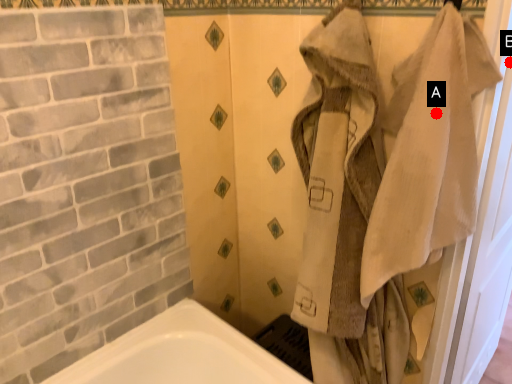
Question: Two points are circled on the image, labeled by A and B beside each circle. Which point is closer to the camera?

Choices:
 (A) A is closer
 (B) B is closer

Answer: (B)